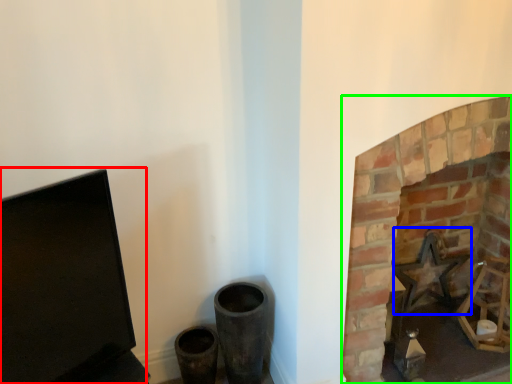
Question: Which object is the farthest from computer monitor (highlighted by a red box)? Choose among these: swivel chair (highlighted by a blue box) or fireplace (highlighted by a green box).

Choices:
 (A) swivel chair
 (B) fireplace

Answer: (A)